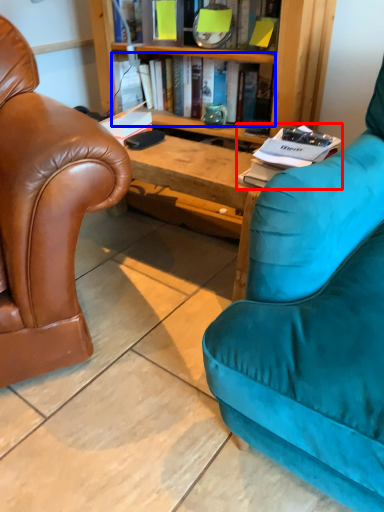
Question: Which object is closer to the camera taking this photo, book (highlighted by a red box) or book (highlighted by a blue box)?

Choices:
 (A) book
 (B) book

Answer: (A)